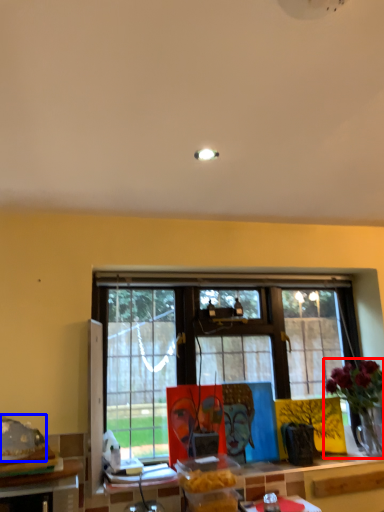
Question: Which object appears closest to the camera in this image, houseplant (highlighted by a red box) or food (highlighted by a blue box)?

Choices:
 (A) houseplant
 (B) food

Answer: (B)